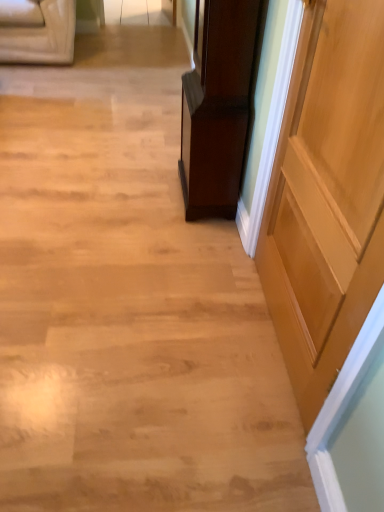
You are a GUI agent. You are given a task and a screenshot of the screen. Output one action in this format:
    pyautogui.click(x=<x>, y=<y>)
    Task: Click on the free point behind light brown wood door at right
    This screenshot has width=384, height=512.
    Given the screenshot: What is the action you would take?
    point(209,258)